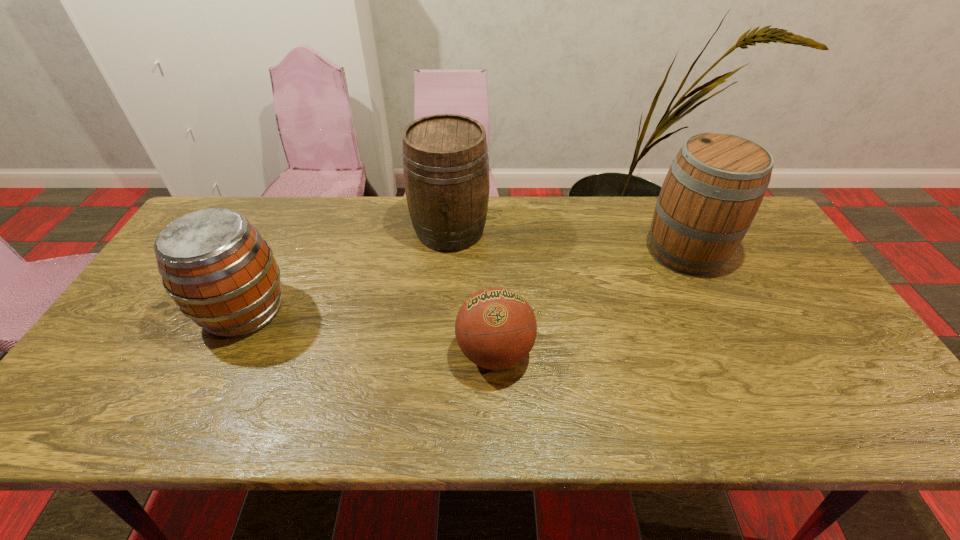
At what (x,y) coordinates should I click in order to perform the action: click on vacant region at the near edge of the desktop. Please return your answer as a coordinate pair (x, y). This screenshot has height=540, width=960. Looking at the image, I should click on (752, 406).

Find the location of a particular element. Image resolution: width=960 pixels, height=540 pixels. vacant space at the left edge of the desktop is located at coordinates (156, 361).

The width and height of the screenshot is (960, 540). In the image, there is a desktop. In order to click on vacant space at the right edge in this screenshot , I will do `click(784, 278)`.

Locate an element on the screen. The height and width of the screenshot is (540, 960). free space at the far left corner of the desktop is located at coordinates tap(224, 207).

The image size is (960, 540). Identify the location of vacant area at the near right corner of the desktop. (856, 410).

The image size is (960, 540). I want to click on free space between the third tallest object and the shortest object, so click(x=370, y=332).

You are a GUI agent. You are given a task and a screenshot of the screen. Output one action in this format:
    pyautogui.click(x=<x>, y=<y>)
    Task: Click on the empty space that is in between the rightmost object and the second cider from left to right
    
    Given the screenshot: What is the action you would take?
    pyautogui.click(x=567, y=241)

Identify the location of free space between the shortest object and the second cider from right to left. The height and width of the screenshot is (540, 960). (472, 292).

You are a GUI agent. You are given a task and a screenshot of the screen. Output one action in this format:
    pyautogui.click(x=<x>, y=<y>)
    Task: Click on the blank region between the leftmost object and the shortest object
    
    Given the screenshot: What is the action you would take?
    coord(370,332)

This screenshot has width=960, height=540. Identify the location of vacant region between the rightmost cider and the second cider from right to left. (567, 241).